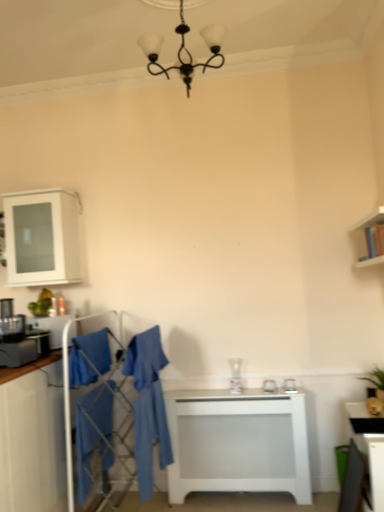
Question: Is white glossy table at lower right, the first table in the front-to-back sequence, far from matte black chair at lower right?

Choices:
 (A) yes
 (B) no

Answer: (B)

Question: Is white glossy table at lower right, which ranks as the 2th table in left-to-right order, further to the viewer compared to matte black chair at lower right?

Choices:
 (A) yes
 (B) no

Answer: (B)

Question: Is white glossy table at lower right, the first table in the front-to-back sequence, closer to the viewer compared to matte black chair at lower right?

Choices:
 (A) yes
 (B) no

Answer: (A)

Question: Is white glossy table at lower right, the first table in the front-to-back sequence, positioned with its back to matte black chair at lower right?

Choices:
 (A) yes
 (B) no

Answer: (A)

Question: Considering the relative sizes of white glossy table at lower right, which is the 1th table in right-to-left order, and matte black chair at lower right in the image provided, is white glossy table at lower right, which is the 1th table in right-to-left order, shorter than matte black chair at lower right?

Choices:
 (A) yes
 (B) no

Answer: (B)

Question: From a real-world perspective, is white glossy table at lower right, the 2th table when ordered from back to front, below matte black chair at lower right?

Choices:
 (A) no
 (B) yes

Answer: (A)

Question: Is the surface of white glossy vase at center, the second appliance viewed from the left, in direct contact with blue cotton robe at lower left, the third robe from the right?

Choices:
 (A) yes
 (B) no

Answer: (B)

Question: Is white glossy vase at center, the first appliance positioned from the bottom, shorter than blue cotton robe at lower left, the third robe from the right?

Choices:
 (A) yes
 (B) no

Answer: (A)

Question: Is white glossy vase at center, which is counted as the first appliance, starting from the back, aimed at blue cotton robe at lower left, the third robe from the right?

Choices:
 (A) yes
 (B) no

Answer: (B)

Question: From a real-world perspective, is white glossy vase at center, the 1th appliance viewed from the right, located higher than blue cotton robe at lower left, the third robe from the right?

Choices:
 (A) no
 (B) yes

Answer: (B)

Question: From the image's perspective, does white glossy vase at center, which is counted as the first appliance, starting from the back, appear lower than blue cotton robe at lower left, the third robe from the right?

Choices:
 (A) no
 (B) yes

Answer: (A)

Question: Is white glossy vase at center, the 1th appliance viewed from the right, smaller than blue cotton robe at lower left, the third robe from the right?

Choices:
 (A) yes
 (B) no

Answer: (A)

Question: Considering the relative sizes of blue fabric swivel chair at center and white glossy table at lower right, which is the 1th table in right-to-left order, in the image provided, is blue fabric swivel chair at center thinner than white glossy table at lower right, which is the 1th table in right-to-left order,?

Choices:
 (A) yes
 (B) no

Answer: (B)